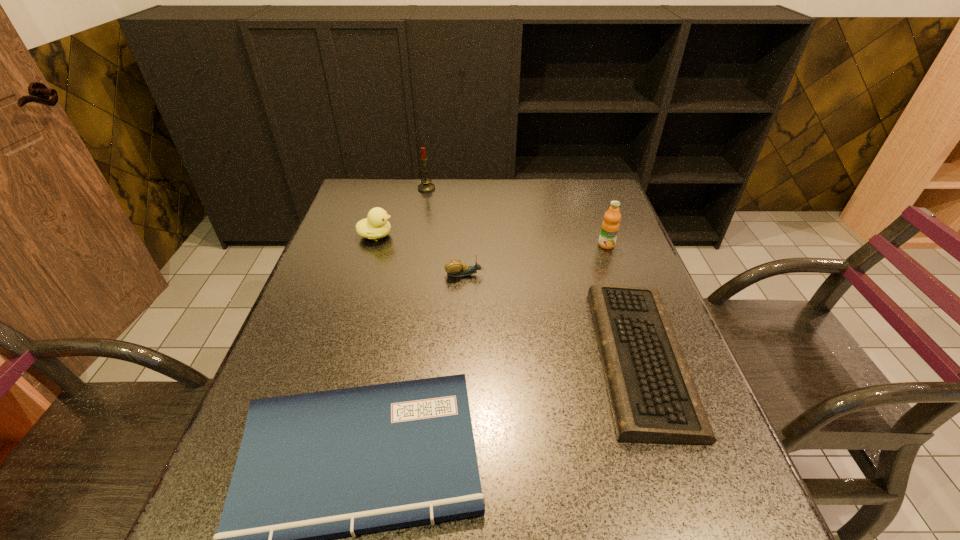
Identify the location of empty location between the computer keyboard and the duckling. (508, 297).

Identify the location of empty space that is in between the duckling and the orange juice. (491, 240).

Find the location of a particular element. The height and width of the screenshot is (540, 960). free area in between the computer keyboard and the candle is located at coordinates (534, 273).

At what (x,y) coordinates should I click in order to perform the action: click on vacant point located between the duckling and the fourth tallest object. Please return your answer as a coordinate pair (x, y). Looking at the image, I should click on (420, 255).

This screenshot has height=540, width=960. What are the coordinates of `free area in between the duckling and the farthest object` in the screenshot? It's located at (401, 212).

Image resolution: width=960 pixels, height=540 pixels. What are the coordinates of `object that ranks as the closest to the candle` in the screenshot? It's located at (376, 226).

Locate an element on the screen. This screenshot has width=960, height=540. object that is the second nearest to the escargot is located at coordinates (653, 397).

Where is `free location that satisfies the following two spatial constraints: 1. on the label of the orange juice; 2. on the front-facing side of the third nearest object`? Image resolution: width=960 pixels, height=540 pixels. free location that satisfies the following two spatial constraints: 1. on the label of the orange juice; 2. on the front-facing side of the third nearest object is located at coordinates (616, 274).

Locate an element on the screen. Image resolution: width=960 pixels, height=540 pixels. free space that satisfies the following two spatial constraints: 1. on the label of the orange juice; 2. on the front-facing side of the third shortest object is located at coordinates (616, 274).

This screenshot has width=960, height=540. Identify the location of blank space that satisfies the following two spatial constraints: 1. at the beak of the duckling; 2. on the left side of the computer keyboard. (339, 358).